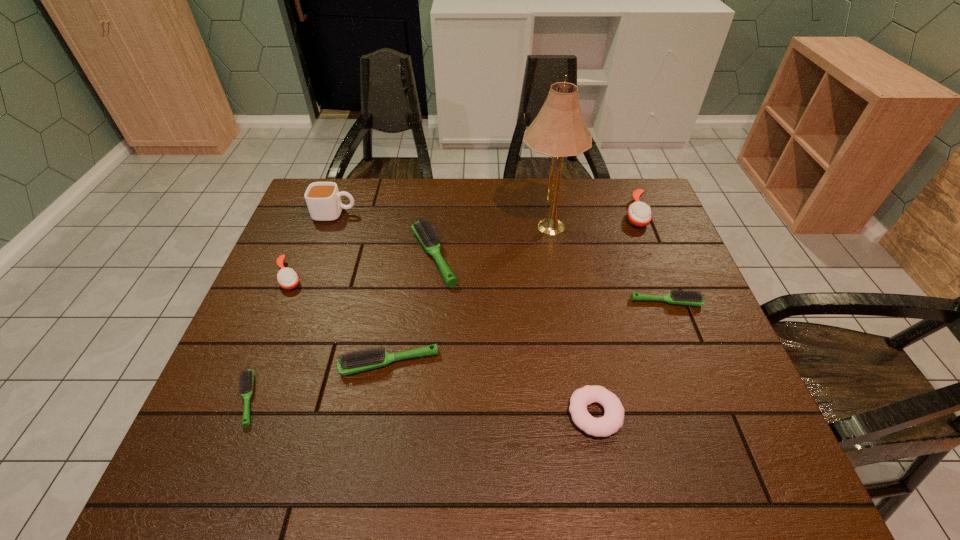
In order to click on blank region between the farthest light hairbrush and the shortest object in this screenshot , I will do `click(341, 328)`.

The width and height of the screenshot is (960, 540). Find the location of `free spot between the shortest hairbrush and the biggest light hairbrush`. free spot between the shortest hairbrush and the biggest light hairbrush is located at coordinates (341, 328).

Where is `free space between the third smallest light hairbrush and the nearer orange hairbrush`? free space between the third smallest light hairbrush and the nearer orange hairbrush is located at coordinates (340, 320).

What are the coordinates of `unoccupied position between the cup and the third smallest light hairbrush` in the screenshot? It's located at (363, 288).

Where is `free space between the cup and the rightmost light hairbrush`? This screenshot has height=540, width=960. free space between the cup and the rightmost light hairbrush is located at coordinates (501, 258).

This screenshot has width=960, height=540. In order to click on blank region between the lampshade and the farther orange hairbrush in this screenshot , I will do `click(590, 220)`.

This screenshot has width=960, height=540. In order to click on free space between the farthest light hairbrush and the third biggest light hairbrush in this screenshot , I will do `click(550, 279)`.

Point out which object is positioned as the seventh nearest to the farthest light hairbrush. Please provide its 2D coordinates. Your answer should be formatted as a tuple, i.e. [(x, y)], where the tuple contains the x and y coordinates of a point satisfying the conditions above.

[(679, 297)]

Locate which object ranks seventh in proximity to the lampshade. Please provide its 2D coordinates. Your answer should be formatted as a tuple, i.e. [(x, y)], where the tuple contains the x and y coordinates of a point satisfying the conditions above.

[(287, 278)]

Find the location of a particular element. hairbrush that stands as the closest to the eighth shortest object is located at coordinates (287, 278).